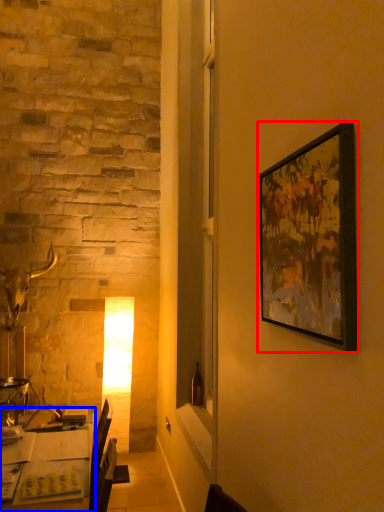
Question: Which object is further to the camera taking this photo, picture frame (highlighted by a red box) or table (highlighted by a blue box)?

Choices:
 (A) picture frame
 (B) table

Answer: (B)